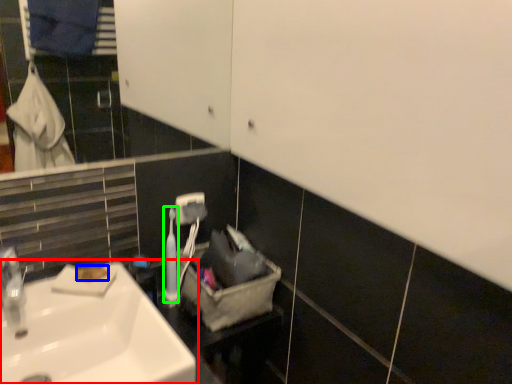
Question: Considering the real-world distances, which object is closest to sink (highlighted by a red box)? soap (highlighted by a blue box) or toiletry (highlighted by a green box).

Choices:
 (A) soap
 (B) toiletry

Answer: (A)